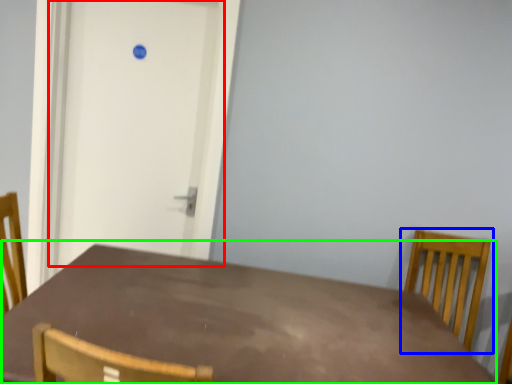
Question: Which object is the closest to the door (highlighted by a red box)? Choose among these: chair (highlighted by a blue box) or table (highlighted by a green box).

Choices:
 (A) chair
 (B) table

Answer: (B)